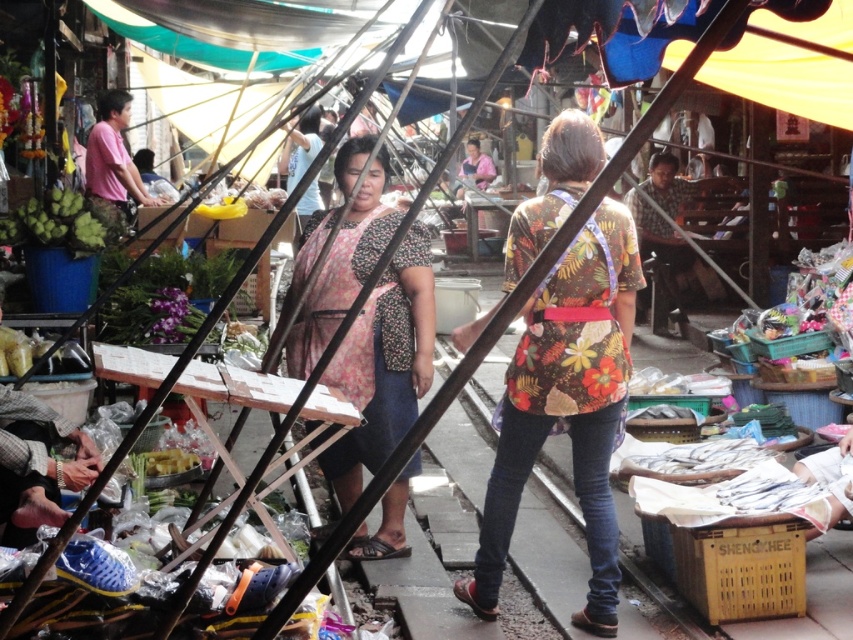
Question: Which of the following is the farthest from the observer?

Choices:
 (A) floral fabric dress at center
 (B) floral fabric shirt at center

Answer: (A)

Question: Does floral fabric shirt at center appear on the right side of floral fabric dress at center?

Choices:
 (A) no
 (B) yes

Answer: (B)

Question: Is floral fabric shirt at center to the right of floral fabric dress at center from the viewer's perspective?

Choices:
 (A) yes
 (B) no

Answer: (A)

Question: Can you confirm if floral fabric shirt at center is bigger than floral fabric dress at center?

Choices:
 (A) yes
 (B) no

Answer: (B)

Question: Which object is closer to the camera taking this photo?

Choices:
 (A) floral fabric shirt at center
 (B) floral fabric dress at center

Answer: (A)